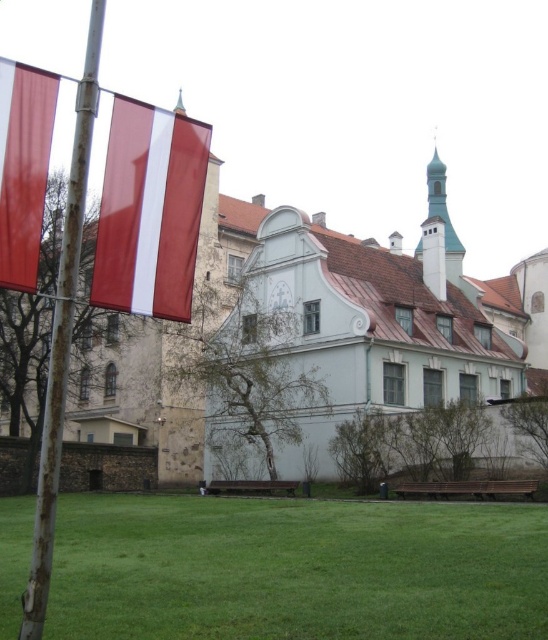
You are standing in the courtyard looking towards the historic buildings. There are two points marked in the scene, one at coordinates point [516,605] and the other at point [19,280]. Which of these points is closer to your current position?

Point [19,280] is closer to your current position because it is nearer to the camera compared to point [516,605], which is further away.